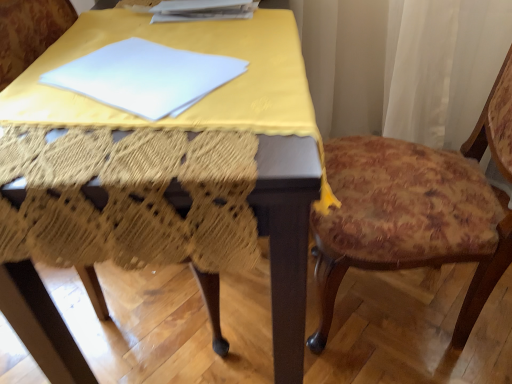
At what (x,y) coordinates should I click in order to perform the action: click on free space in front of white paper at upper center. Please return your answer as a coordinate pair (x, y). Looking at the image, I should click on (198, 39).